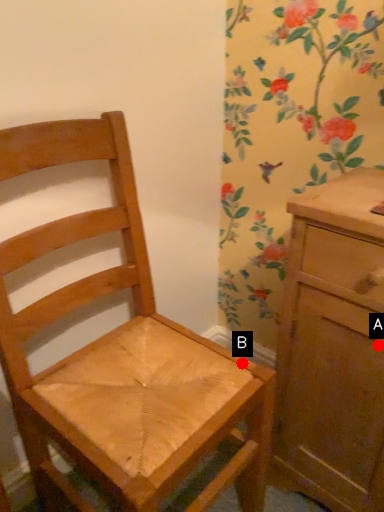
Question: Two points are circled on the image, labeled by A and B beside each circle. Which of the following is the closest to the observer?

Choices:
 (A) A is closer
 (B) B is closer

Answer: (A)